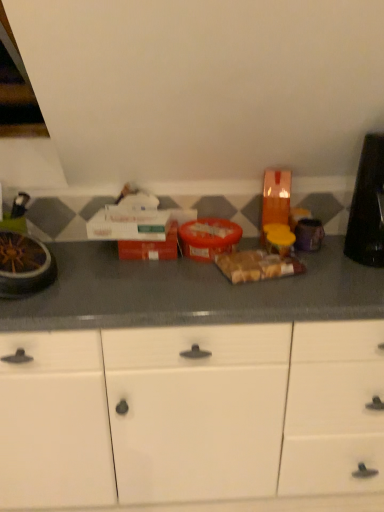
You are a GUI agent. You are given a task and a screenshot of the screen. Output one action in this format:
    pyautogui.click(x=<x>, y=<y>)
    Task: Click on the vacant area that lies in front of black plastic toaster at right, which ranks as the 2th appliance in left-to-right order
    This screenshot has height=512, width=384.
    Given the screenshot: What is the action you would take?
    pyautogui.click(x=357, y=275)